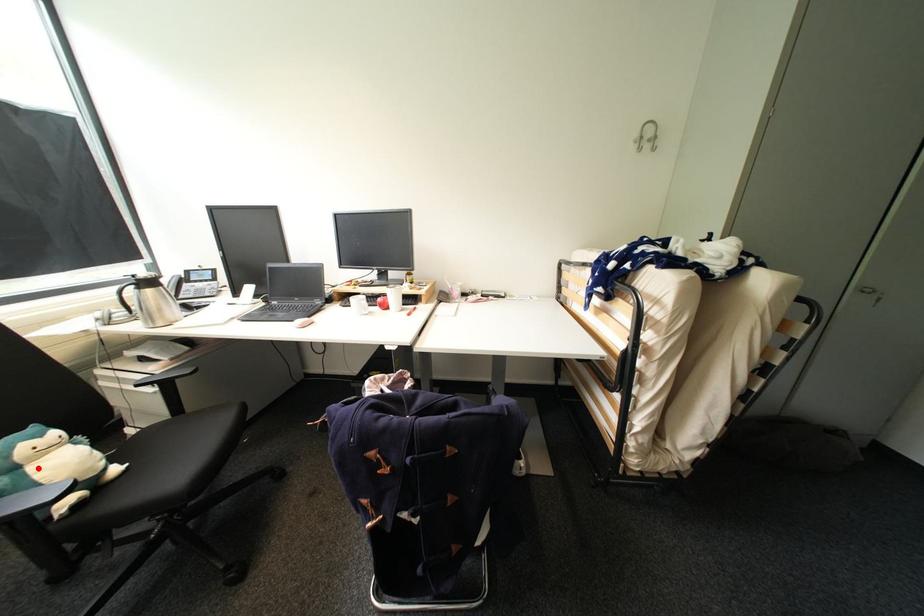
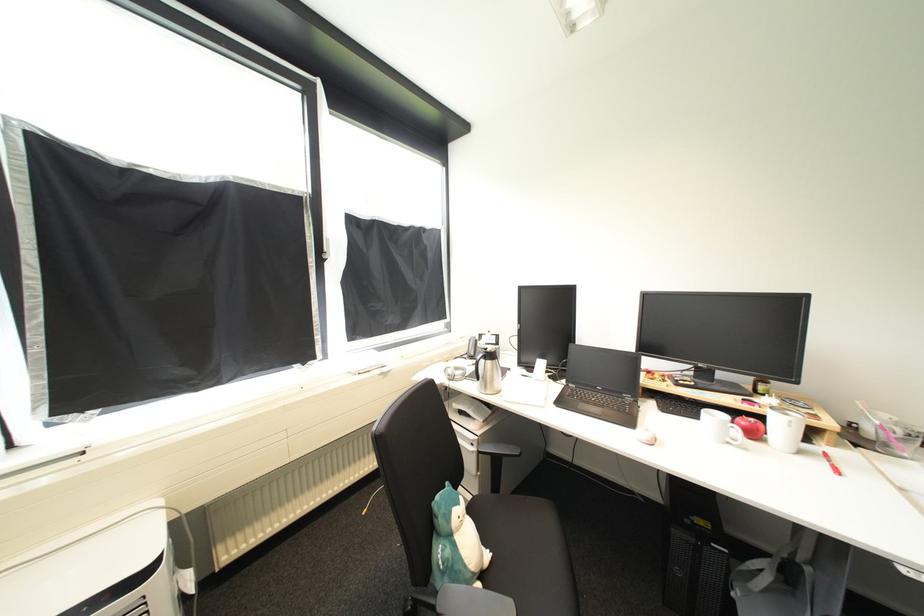
Question: I am providing you with two images of the same scene from different viewpoints. A red point is shown in image1. For the corresponding object point in image2, is it positioned nearer or farther from the camera?

Choices:
 (A) Nearer
 (B) Farther

Answer: (B)